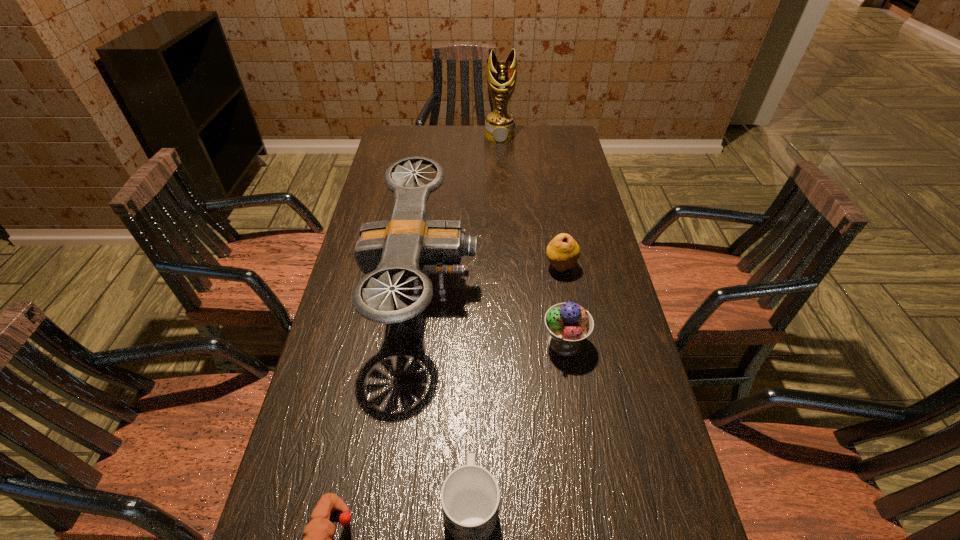
Locate an element on the screen. The height and width of the screenshot is (540, 960). object that is at the left edge is located at coordinates (407, 244).

Where is `icecream that is at the right edge`? This screenshot has width=960, height=540. icecream that is at the right edge is located at coordinates (568, 324).

This screenshot has width=960, height=540. What are the coordinates of `pear that is positioned at the right edge` in the screenshot? It's located at (563, 251).

At what (x,y) coordinates should I click in order to perform the action: click on free space at the far edge of the desktop. Please return your answer as a coordinate pair (x, y). The height and width of the screenshot is (540, 960). Looking at the image, I should click on (446, 156).

Identify the location of vacant space at the left edge of the desktop. Image resolution: width=960 pixels, height=540 pixels. (381, 184).

In the image, there is a desktop. At what (x,y) coordinates should I click in order to perform the action: click on vacant space at the right edge. Please return your answer as a coordinate pair (x, y). This screenshot has width=960, height=540. Looking at the image, I should click on (579, 263).

Identify the location of vacant region at the far left corner. (387, 141).

This screenshot has height=540, width=960. I want to click on vacant space at the far right corner of the desktop, so (558, 130).

I want to click on free space between the icecream and the farthest object, so click(x=532, y=239).

You are a GUI agent. You are given a task and a screenshot of the screen. Output one action in this format:
    pyautogui.click(x=<x>, y=<y>)
    Task: Click on the vacant space in between the icecream and the fifth shortest object
    
    Given the screenshot: What is the action you would take?
    pyautogui.click(x=493, y=313)